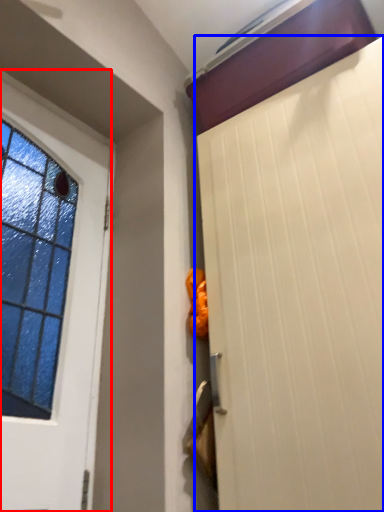
Question: Which object appears closest to the camera in this image, door (highlighted by a red box) or door (highlighted by a blue box)?

Choices:
 (A) door
 (B) door

Answer: (B)